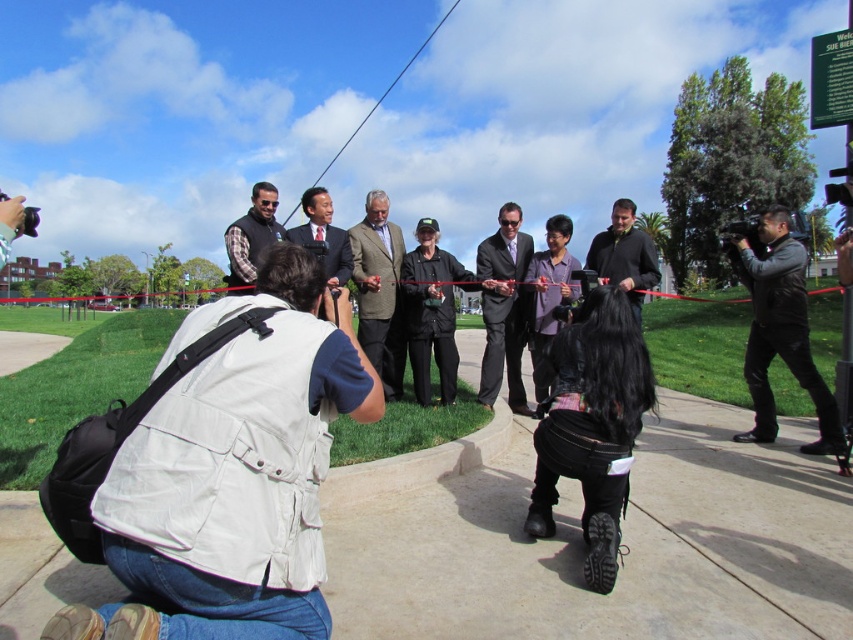
Question: Can you confirm if light brown textured suit at center is smaller than matte black suit at center?

Choices:
 (A) no
 (B) yes

Answer: (B)

Question: Which point is closer to the camera?

Choices:
 (A) (541, 308)
 (B) (241, 250)
 (C) (369, 602)
 (D) (267, 516)

Answer: (D)

Question: Which object is the farthest from the white fabric vest at lower left?

Choices:
 (A) black leather jacket at right
 (B) light brown textured suit at center
 (C) dark brown leather jacket at center
 (D) metallic wire at upper center

Answer: (D)

Question: Which of these objects is positioned farthest from the black matte suit at center?

Choices:
 (A) white fabric vest at lower left
 (B) black leather jacket at right
 (C) dark brown leather jacket at center

Answer: (A)

Question: Can you confirm if matte black vest at center is positioned to the right of matte black suit at center?

Choices:
 (A) yes
 (B) no

Answer: (B)

Question: Is black matte suit at center positioned at the back of metallic wire at upper center?

Choices:
 (A) yes
 (B) no

Answer: (B)